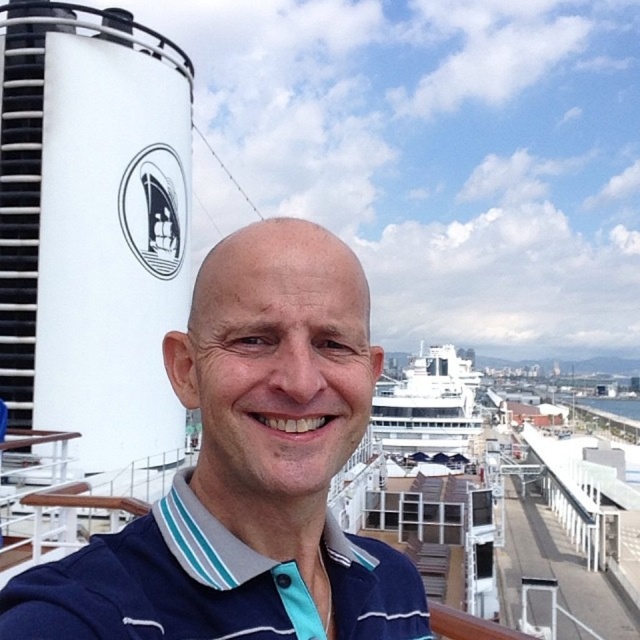
You are standing on the deck of a cruise ship and want to take a photo of the point at coordinates (184, 524). If your camera has a maximum focus range of 8 meters, will it be able to capture the point clearly?

The distance of point (184, 524) from the viewer is 8.21 meters, which exceeds the camera maximum focus range of 8 meters. Therefore, the camera will not be able to capture the point clearly.

You are a photographer trying to capture a clear image of the navy blue cotton polo shirt at center from your current position. Considering the distance between you and the shirt, what is the minimum focal length required for your camera lens to ensure the subject fills the frame without distortion?

The minimum focal length required would depend on the sensor size of the camera. However, given the distance of 21.54 feet between you and the navy blue cotton polo shirt at center, a longer focal length around 200mm to 300mm is typically recommended to reduce distortion and ensure the subject fills the frame appropriately.

You are a photographer trying to capture a photo of the navy blue polo shirt at center and the white glossy cruise ship at upper center. Which object should you focus on first if you want to ensure both are in the frame without moving the camera?

You should focus on the navy blue polo shirt at center first because it occupies less space than the white glossy cruise ship at upper center, so it will be easier to frame while keeping both in the shot.